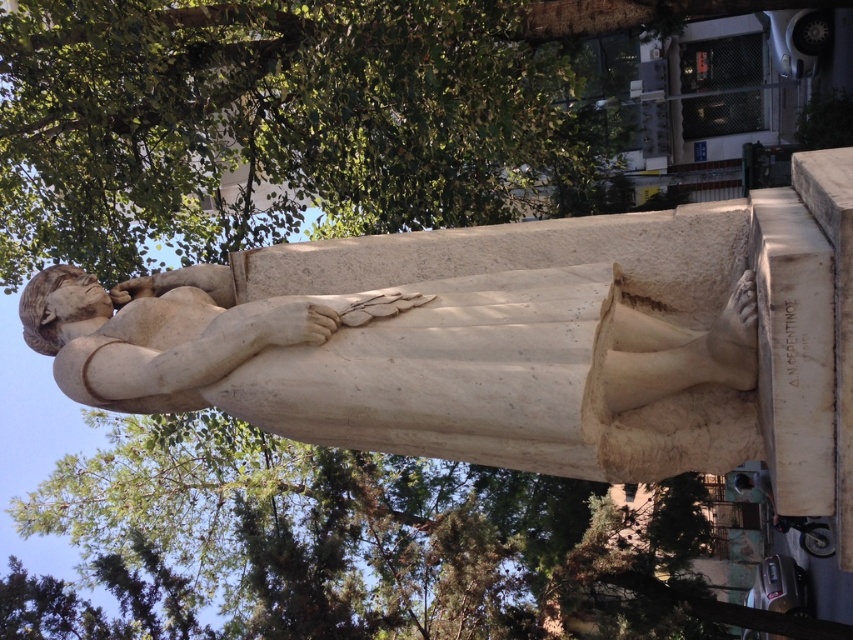
You are standing in front of the classical marble statue and want to take a photo. There are two points on the statue that you need to focus on. The first point is located at coordinates point (451, 208) and the second point is at point (585, 476). Given that you want to ensure both points are in focus, which point should you focus on first to maximize the depth of field?

You should focus on point (451, 208) first because it is closer to the camera than point (585, 476). By focusing on the closer point, the depth of field will extend further back, potentially covering both points more effectively.

You are a photographer planning to take a picture of the white marble statue at center. You want to ensure the green leafy tree at upper center doesn not block the statue in the photo. Is the tree likely to be taller than the statue?

The green leafy tree at upper center is much taller than the white marble statue at center, so it is likely to block the statue if positioned directly in front or above it.